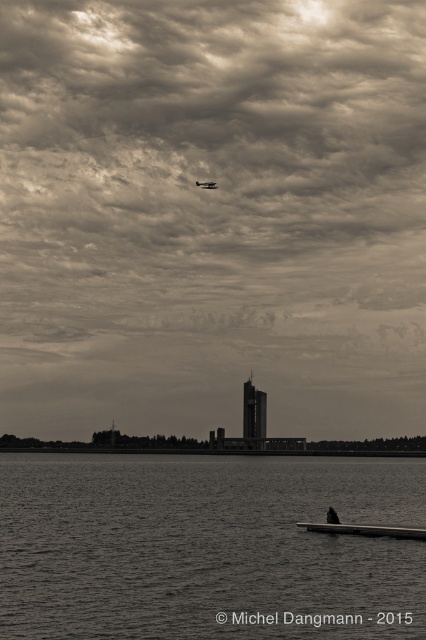
You are a photographer wanting to capture both the smooth wooden boat at lower center and the metallic silver seaplane at upper center in the same frame. Based on their positions, which object would appear closer to the camera in the photo?

The smooth wooden boat at lower center appears closer to the camera because it is positioned in front of the metallic silver seaplane at upper center.

You are a photographer who wants to capture the cloudy sky at upper center in this lakeside scene. Considering the distance provided, what equipment might you need to ensure the sky is in focus and clear?

The cloudy sky at upper center is 649.32 meters away from the camera. To capture it clearly and in focus, you would need a telephoto lens with a long focal length to zoom in on the distant sky and ensure sharpness.